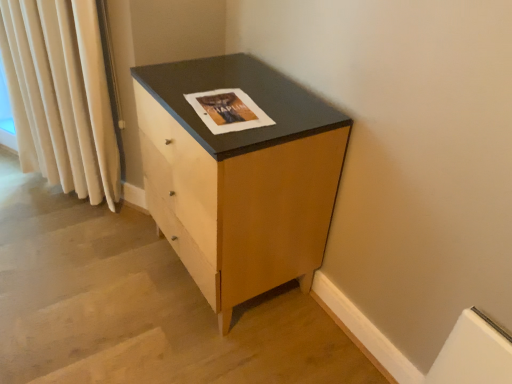
This screenshot has height=384, width=512. Identify the location of unoccupied space behind matte paper magazine at center. (231, 78).